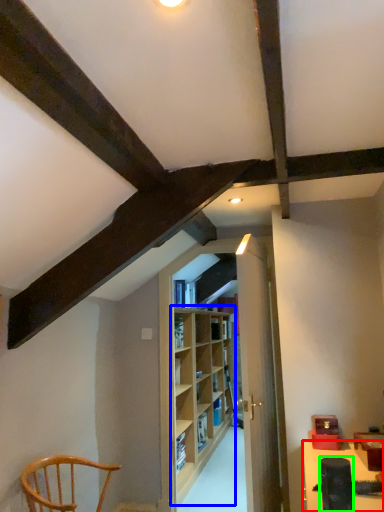
Question: Based on their relative distances, which object is farther from table (highlighted by a red box)? Choose from shelf (highlighted by a blue box) and lift (highlighted by a green box).

Choices:
 (A) shelf
 (B) lift

Answer: (A)